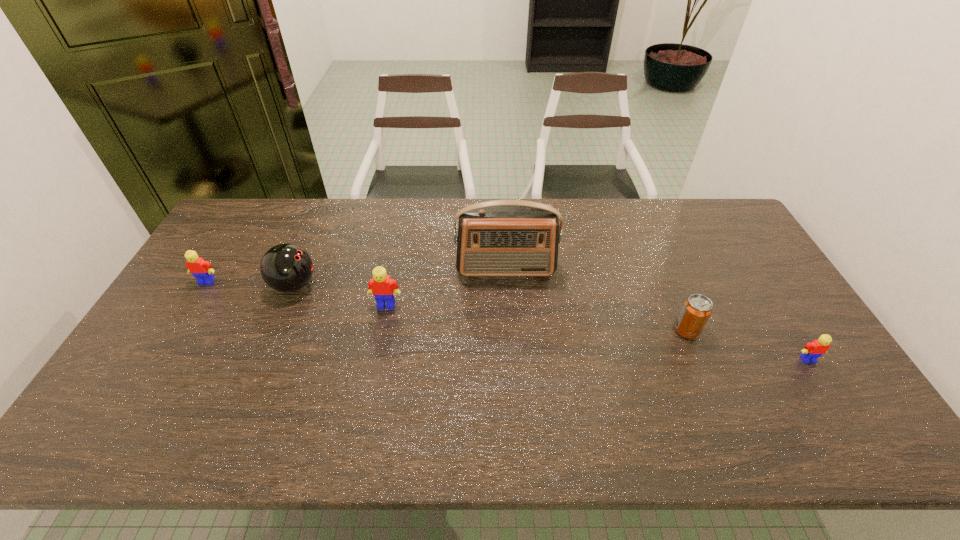
In order to click on the fifth object from right to left in this screenshot , I will do `click(286, 267)`.

I want to click on vacant space positioned on the front-facing side of the leftmost Lego, so (x=148, y=379).

The image size is (960, 540). Find the location of `vacant space located on the front-facing side of the second farthest Lego`. vacant space located on the front-facing side of the second farthest Lego is located at coordinates (x=375, y=362).

The image size is (960, 540). Find the location of `vacant region located 0.060m on the front-facing side of the nearest object`. vacant region located 0.060m on the front-facing side of the nearest object is located at coordinates [x=823, y=383].

What are the coordinates of `vacant space located 0.080m on the left of the second object from right to left` in the screenshot? It's located at (645, 330).

Where is `vacant space located 0.380m on the front-facing side of the radio receiver`? This screenshot has height=540, width=960. vacant space located 0.380m on the front-facing side of the radio receiver is located at coordinates (513, 388).

Find the location of a particular element. free space located on the surface of the fifth object from right to left near the finger holes is located at coordinates (393, 285).

Find the location of a particular element. The image size is (960, 540). object at the left edge is located at coordinates (201, 269).

Identify the location of object that is at the right edge. This screenshot has width=960, height=540. (812, 351).

Where is `free space at the far edge`? free space at the far edge is located at coordinates (595, 231).